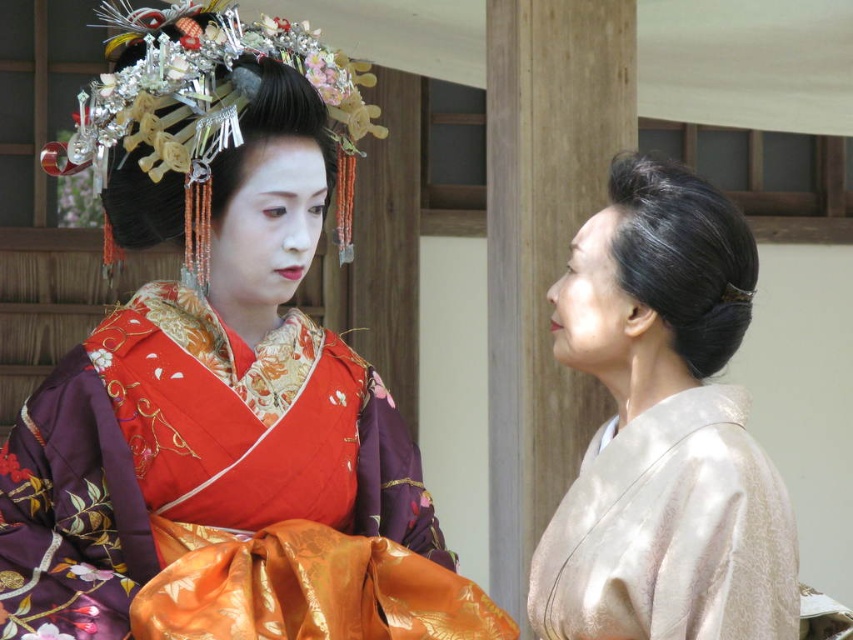
From the picture: You are standing in a traditional Japanese setting and see the silky purple kimono at center. Where is it located in the image?

The silky purple kimono at center is located at point 0.583 on the horizontal axis and 0.260 on the vertical axis.